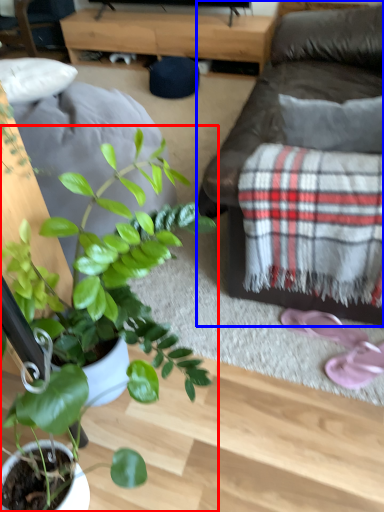
Question: Which point is further to the camera, houseplant (highlighted by a red box) or studio couch (highlighted by a blue box)?

Choices:
 (A) houseplant
 (B) studio couch

Answer: (B)